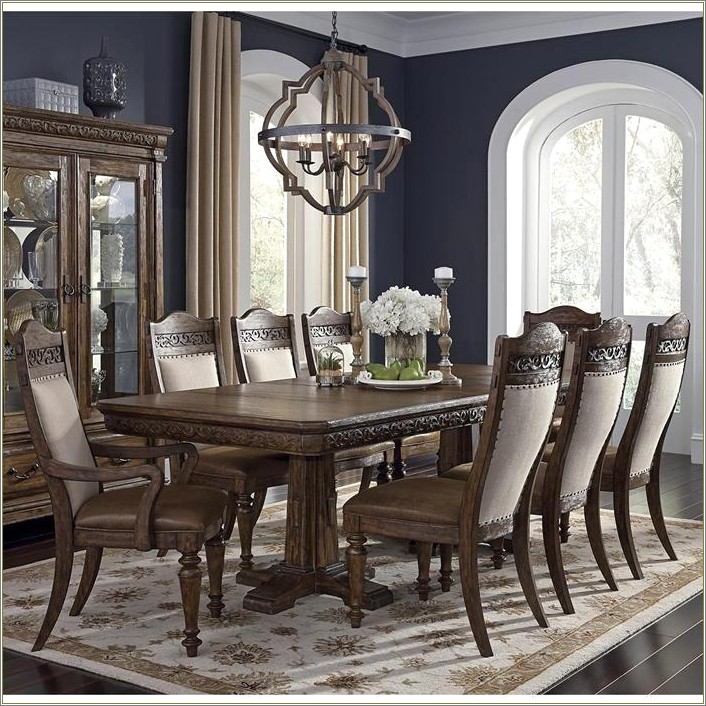
The height and width of the screenshot is (706, 706). Find the location of `fancy chair`. fancy chair is located at coordinates (140, 486), (414, 505), (596, 436), (652, 418), (577, 318), (327, 318), (258, 347), (186, 356).